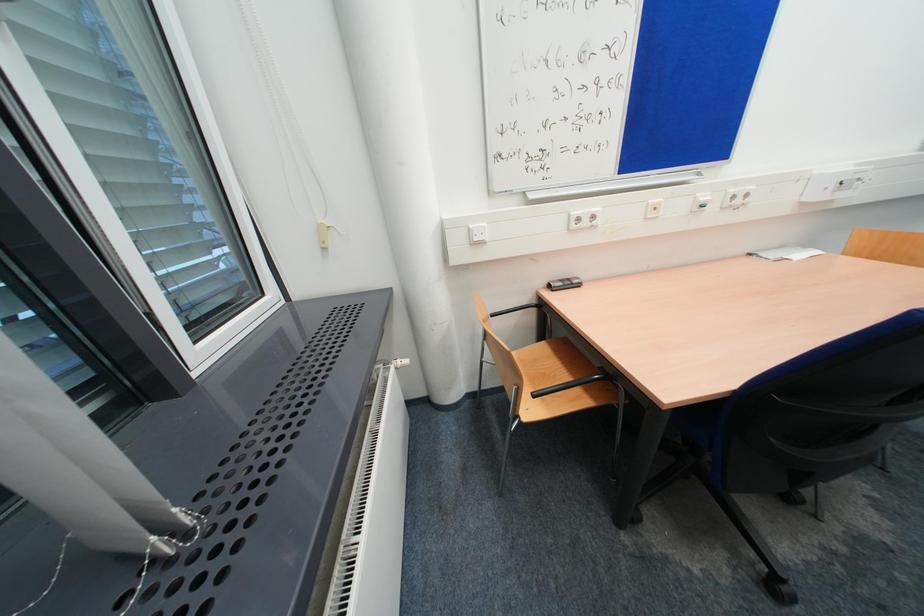
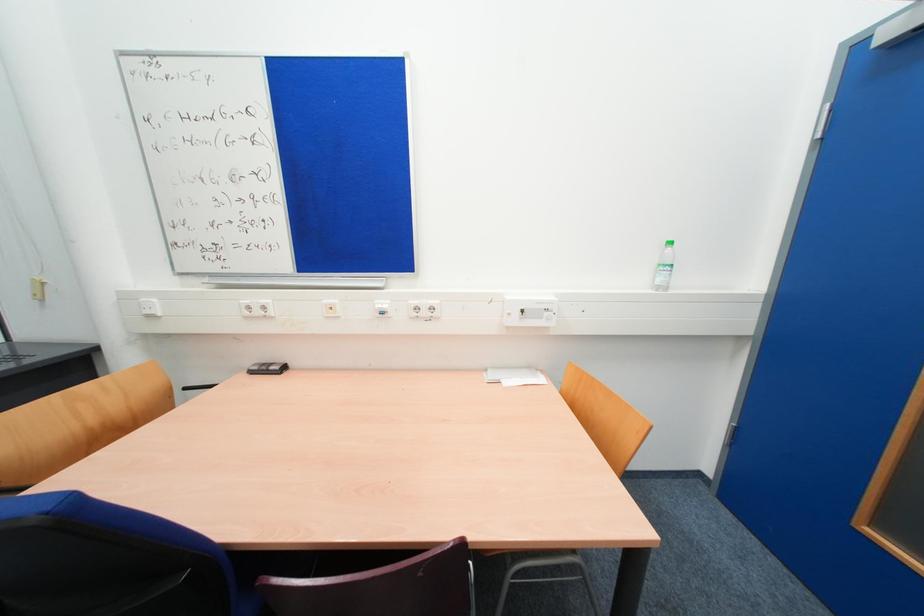
Question: The images are taken continuously from a first-person perspective. In which direction are you moving?

Choices:
 (A) Left
 (B) Right
 (C) Forward
 (D) Backward

Answer: (B)